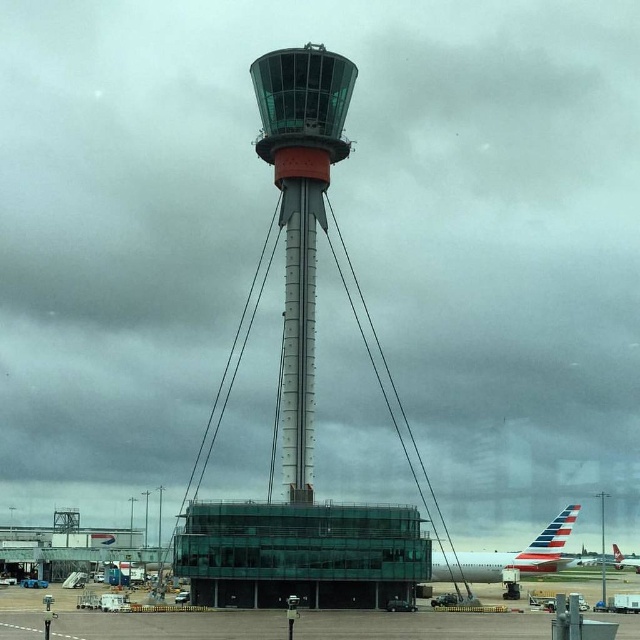
You are an air traffic controller standing at the observation deck of the tower. You notice two points marked on your radar screen at coordinates point [253,77] and point [554,557]. Which point is closer to your current position?

Point [253,77] is in front of point [554,557], so it is closer to your current position at the observation deck.

You are an airport engineer inspecting the air traffic control tower. You need to determine if the transparent glass tower at center is within the structural limits of the airport property. The property boundary is marked at coordinates x between 0.5 and 0.7 and y between 0.4 and 0.6. Is the point at coordinates point [307,390] within the property boundary?

The point [307,390] is within the property boundary since its x coordinate 0.611 is between 0.5 and 0.7 and its y coordinate 0.480 is between 0.4 and 0.6. Therefore, the transparent glass tower at center is within the structural limits of the airport property.

You are an airport security officer standing at the entrance of the lower building. You see the glassy steel tower at center and the polished aluminum airplane at lower right. Which object is closer to you?

The glassy steel tower at center is closer to you because the polished aluminum airplane at lower right is behind it.